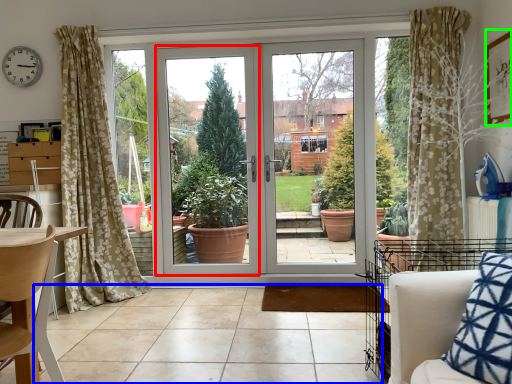
Question: Considering the real-world distances, which object is closest to window frame (highlighted by a red box)? tile (highlighted by a blue box) or picture frame (highlighted by a green box).

Choices:
 (A) tile
 (B) picture frame

Answer: (A)